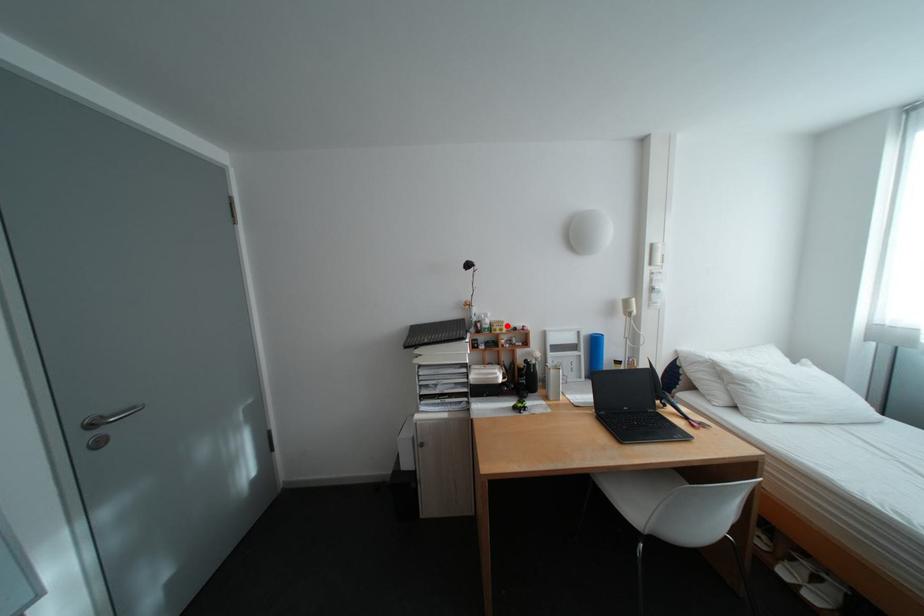
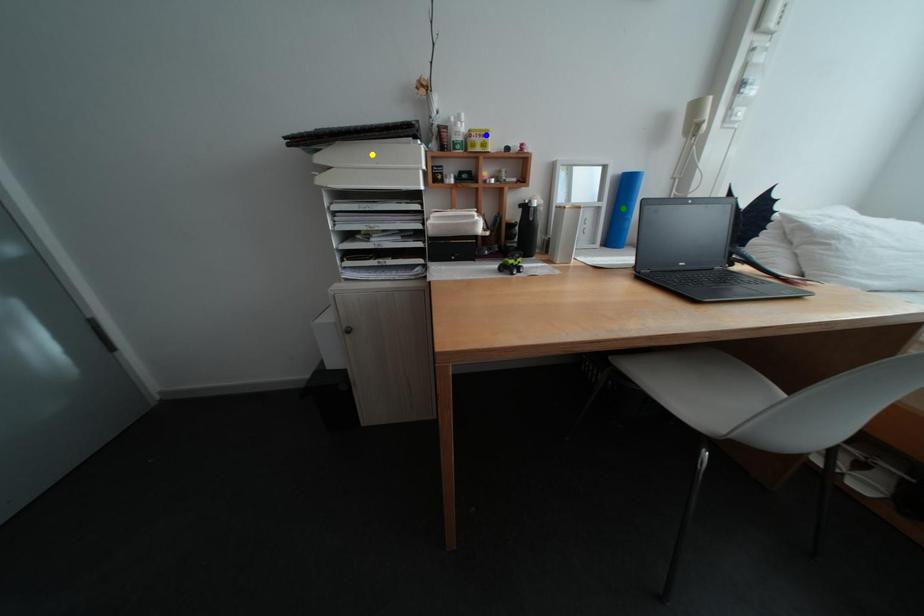
Question: I am providing you with two images of the same scene from different viewpoints. A red point is marked on the first image. You are given multiple points on the second image. Can you choose the point in image 2 that corresponds to the point in image 1?

Choices:
 (A) green point
 (B) blue point
 (C) yellow point

Answer: (B)